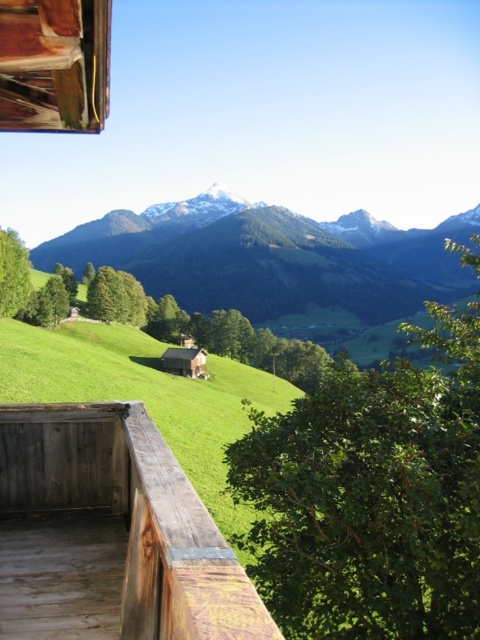
You are standing on the wooden balcony and want to determine which of the two points, point (49, 547) or point (211, 257), is closer to you. Based on the scene, which one would you say is nearer?

Point (49, 547) is closer to the viewer than point (211, 257).

You are standing on the weathered wood deck at lower left and want to walk to the green grassy field at center. Which direction should you move to reach it?

The green grassy field at center is above the weathered wood deck at lower left, so you should move upward to reach it.

You are standing on the wooden balcony and want to walk towards the green grassy field at center. Which direction should you move relative to the weathered wood deck at lower left?

You should move to the right of the weathered wood deck at lower left to reach the green grassy field at center since the deck is positioned to the left of the field.